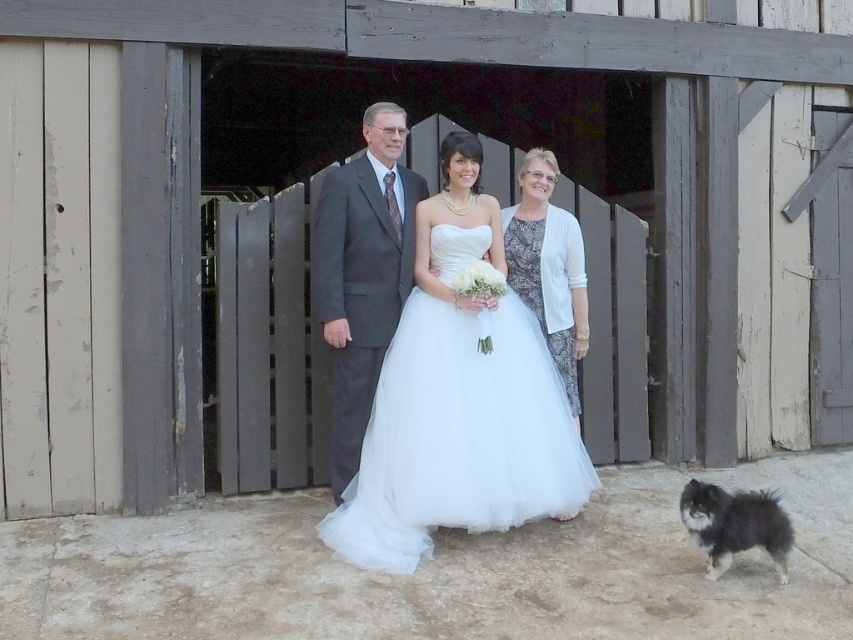
Question: Which is farther from the white textured dress at center?

Choices:
 (A) dark gray suit at center
 (B) white tulle wedding dress at center

Answer: (A)

Question: Which point is farther to the camera?

Choices:
 (A) (500, 355)
 (B) (693, 493)
 (C) (537, 257)
 (D) (346, 340)

Answer: (C)

Question: Can you confirm if dark gray suit at center is positioned to the right of fluffy black fur dog at lower right?

Choices:
 (A) no
 (B) yes

Answer: (A)

Question: Which point appears farthest from the camera in this image?

Choices:
 (A) (532, 216)
 (B) (329, 317)
 (C) (722, 522)
 (D) (445, 406)

Answer: (A)

Question: Is white tulle wedding dress at center closer to the viewer compared to dark gray suit at center?

Choices:
 (A) yes
 (B) no

Answer: (A)

Question: Observing the image, what is the correct spatial positioning of white tulle wedding dress at center in reference to white textured dress at center?

Choices:
 (A) right
 (B) left

Answer: (B)